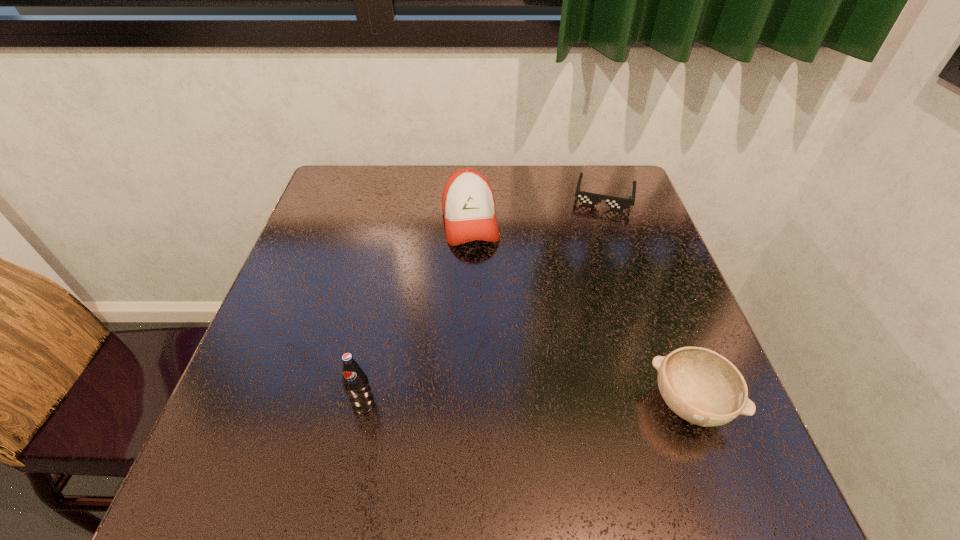
Locate an element on the screen. This screenshot has height=540, width=960. object positioned at the near right corner is located at coordinates (x=701, y=386).

Identify the location of vacant area at the far edge. This screenshot has width=960, height=540. (544, 186).

The image size is (960, 540). I want to click on free space at the near edge of the desktop, so click(x=586, y=429).

The width and height of the screenshot is (960, 540). In order to click on vacant position at the left edge of the desktop in this screenshot , I will do `click(307, 248)`.

You are a GUI agent. You are given a task and a screenshot of the screen. Output one action in this format:
    pyautogui.click(x=<x>, y=<y>)
    Task: Click on the blank space at the right edge of the desktop
    Image resolution: width=960 pixels, height=540 pixels.
    Given the screenshot: What is the action you would take?
    pyautogui.click(x=619, y=268)

Locate an element on the screen. free point at the far left corner is located at coordinates (342, 176).

This screenshot has width=960, height=540. Identify the location of vacant space at the far right corner of the desktop. (611, 172).

This screenshot has height=540, width=960. In order to click on free space between the leftmost object and the sunglasses in this screenshot , I will do 484,300.

Where is `free spot between the sunglasses and the second object from left to right`? The width and height of the screenshot is (960, 540). free spot between the sunglasses and the second object from left to right is located at coordinates (538, 209).

At what (x,y) coordinates should I click in order to perform the action: click on free space between the baseball cap and the shortest object. Please return your answer as a coordinate pair (x, y). Looking at the image, I should click on (538, 209).